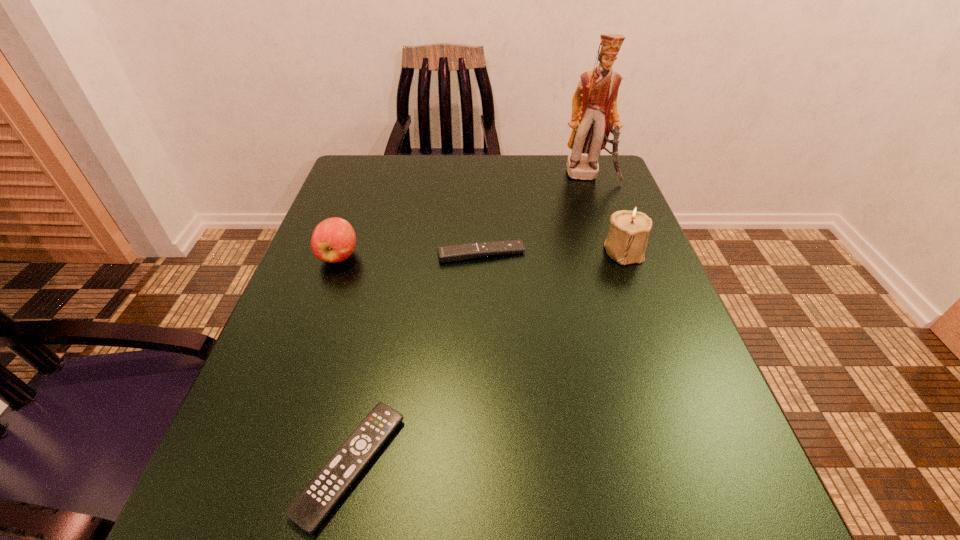
The height and width of the screenshot is (540, 960). What are the coordinates of `the tallest object` in the screenshot? It's located at (594, 104).

This screenshot has height=540, width=960. I want to click on nutcracker, so click(594, 104).

Where is `candle_holder`? The image size is (960, 540). candle_holder is located at coordinates (628, 235).

This screenshot has width=960, height=540. I want to click on apple, so click(333, 240).

Image resolution: width=960 pixels, height=540 pixels. What are the coordinates of `the leftmost object` in the screenshot? It's located at (333, 240).

You are a GUI agent. You are given a task and a screenshot of the screen. Output one action in this format:
    pyautogui.click(x=<x>, y=<y>)
    Task: Click on the farther remote control
    
    Given the screenshot: What is the action you would take?
    pyautogui.click(x=451, y=253)

Find the location of a particular element. The height and width of the screenshot is (540, 960). the right remote control is located at coordinates (451, 253).

Find the location of a particular element. Image resolution: width=960 pixels, height=540 pixels. the second object from left to right is located at coordinates (309, 509).

The width and height of the screenshot is (960, 540). I want to click on the nearest object, so click(309, 509).

I want to click on vacant space located on the front-facing side of the tallest object, so click(627, 281).